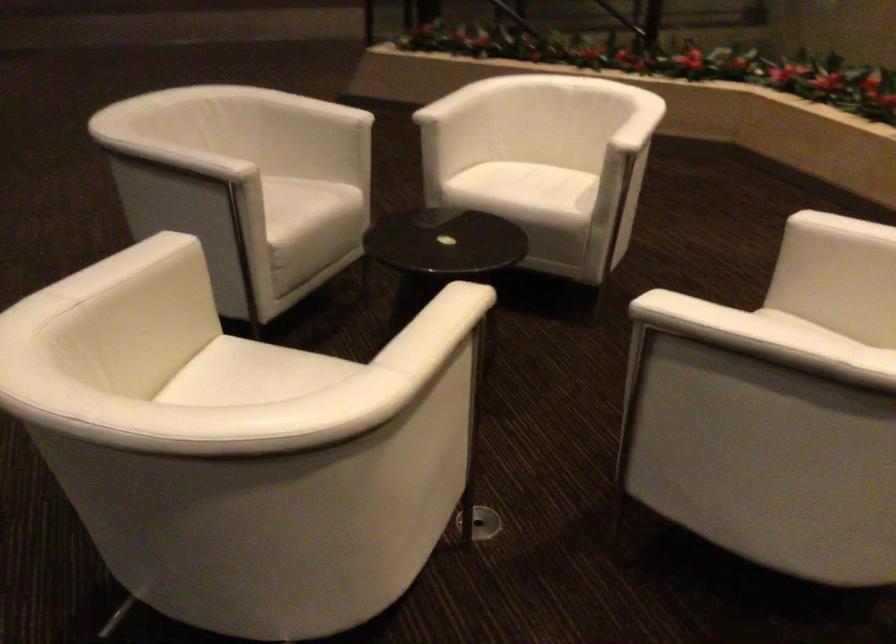
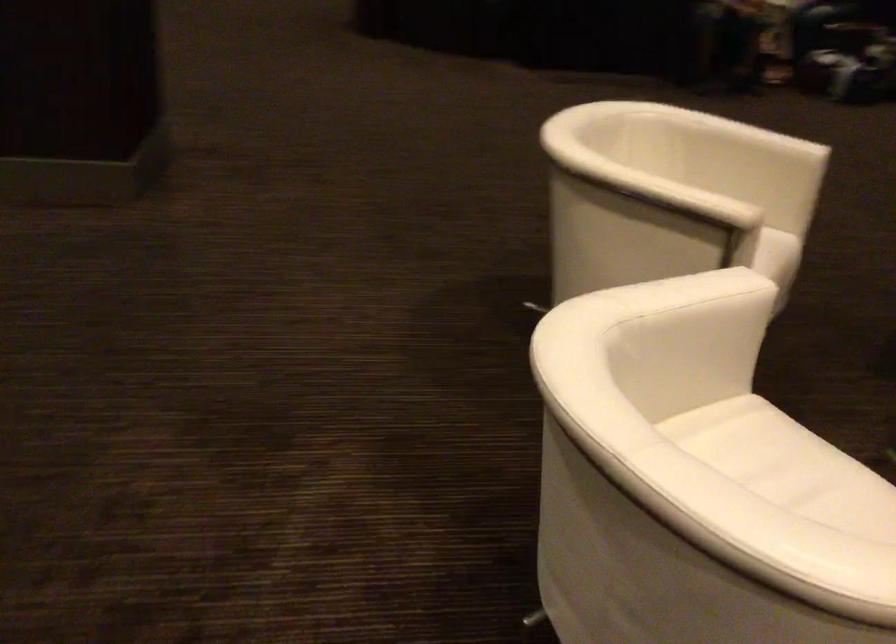
Find the pixel in the second image that matches (468,392) in the first image.

(676, 261)